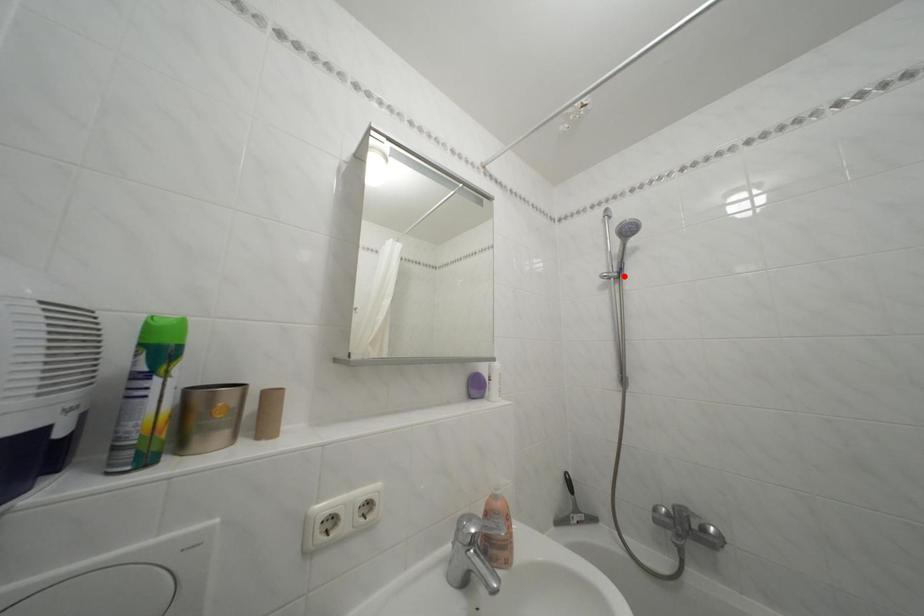
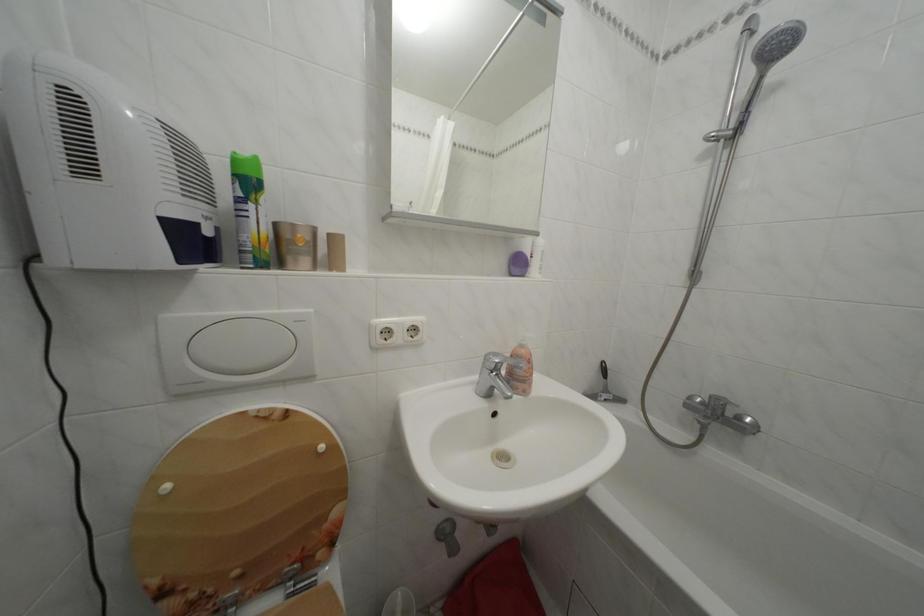
The point at the highlighted location is marked in the first image. Where is the corresponding point in the second image?

(742, 132)